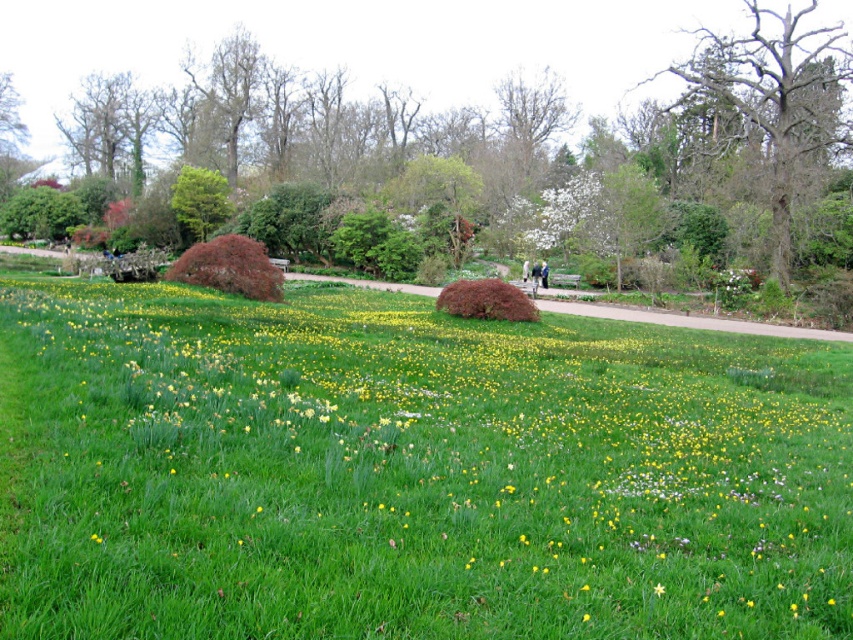
Question: Among these objects, which one is farthest from the camera?

Choices:
 (A) bare wood tree at upper right
 (B) light pink fabric at center
 (C) green leafy tree at center
 (D) dark blue jacket at center

Answer: (B)

Question: Which of the following is the closest to the observer?

Choices:
 (A) grassy path at center
 (B) shiny reddish-brown bush at center-left
 (C) green leafy bush at left
 (D) green grass at lower left

Answer: (D)

Question: Which point is closer to the camera?

Choices:
 (A) shiny reddish-brown bush at center-left
 (B) green leafy tree at center
 (C) light pink fabric at center
 (D) grassy path at center

Answer: (D)

Question: Does shiny reddish-brown bush at center-left appear under green leafy bush at left?

Choices:
 (A) yes
 (B) no

Answer: (A)

Question: Considering the relative positions of green grass at lower left and dark blue jacket at center in the image provided, where is green grass at lower left located with respect to dark blue jacket at center?

Choices:
 (A) left
 (B) right

Answer: (A)

Question: Does green grass at lower left have a smaller size compared to grassy path at center?

Choices:
 (A) no
 (B) yes

Answer: (B)